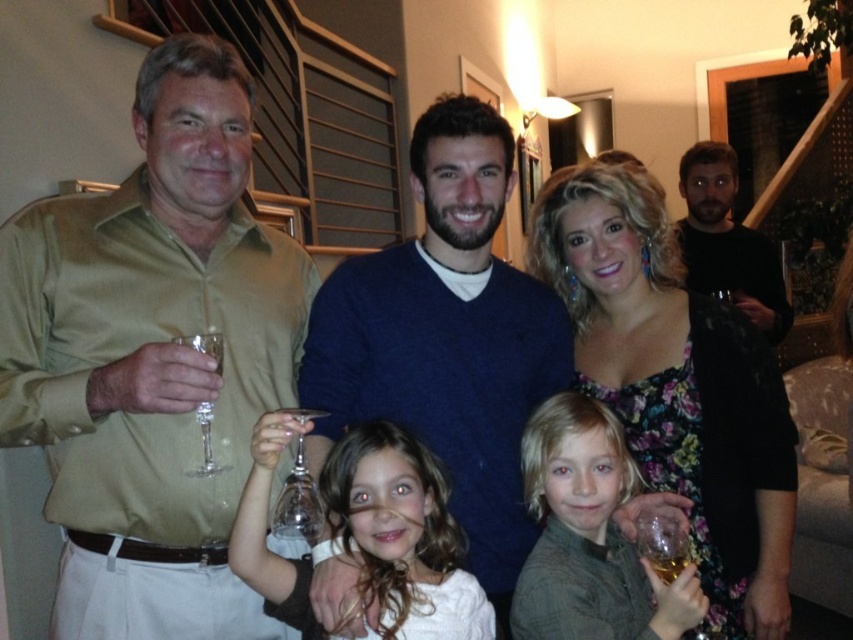
Question: Which is farther from the translucent glass wine glass at lower right?

Choices:
 (A) clear glass wine glass at left
 (B) matte khaki shirt at left
 (C) translucent glass at lower right
 (D) matte gray sweater at center

Answer: (B)

Question: Is the position of matte gray sweater at center more distant than that of transparent glass wine glass at lower center?

Choices:
 (A) no
 (B) yes

Answer: (B)

Question: Which object appears closest to the camera in this image?

Choices:
 (A) black matte shirt at upper right
 (B) clear glass wine glass at left
 (C) translucent glass at lower right

Answer: (B)

Question: Among these objects, which one is farthest from the camera?

Choices:
 (A) transparent glass wine glass at lower center
 (B) white matte dress at center
 (C) matte gray sweater at center
 (D) black matte shirt at upper right

Answer: (D)

Question: Considering the relative positions of dark blue sweater at center and floral dress at center in the image provided, where is dark blue sweater at center located with respect to floral dress at center?

Choices:
 (A) above
 (B) below

Answer: (A)

Question: Does dark blue sweater at center have a greater width compared to floral dress at center?

Choices:
 (A) no
 (B) yes

Answer: (B)